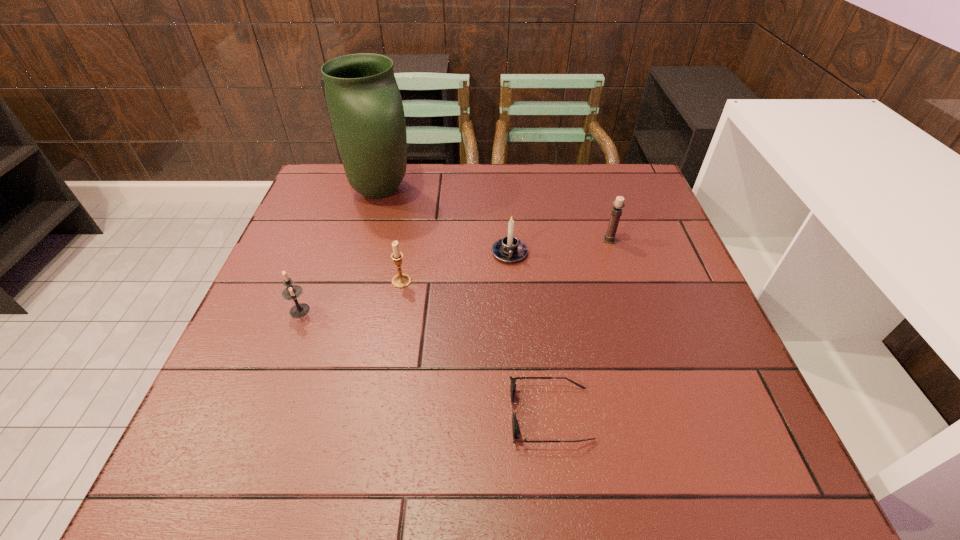
Where is `vase at the left edge`? vase at the left edge is located at coordinates (365, 107).

At what (x,y) coordinates should I click in order to perform the action: click on candle holder that is positioned at the left edge. Please return your answer as a coordinate pair (x, y). The image size is (960, 540). Looking at the image, I should click on (292, 292).

Locate an element on the screen. object located at the right edge is located at coordinates (618, 204).

Locate an element on the screen. object present at the far left corner is located at coordinates (365, 107).

This screenshot has width=960, height=540. I want to click on free space at the far edge, so click(538, 193).

Locate an element on the screen. free space at the near edge of the desktop is located at coordinates (451, 442).

In the image, there is a desktop. Identify the location of free region at the left edge. The height and width of the screenshot is (540, 960). (329, 269).

The image size is (960, 540). What are the coordinates of `vacant space at the right edge of the desktop` in the screenshot? It's located at (664, 264).

What are the coordinates of `vacant space at the far left corner of the desktop` in the screenshot? It's located at (341, 187).

This screenshot has height=540, width=960. Identify the location of vacant region at the near right corner. (681, 455).